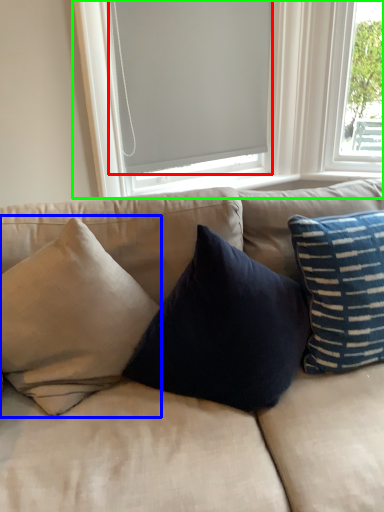
Question: Which is nearer to the window screen (highlighted by a red box)? pillow (highlighted by a blue box) or window (highlighted by a green box).

Choices:
 (A) pillow
 (B) window

Answer: (B)